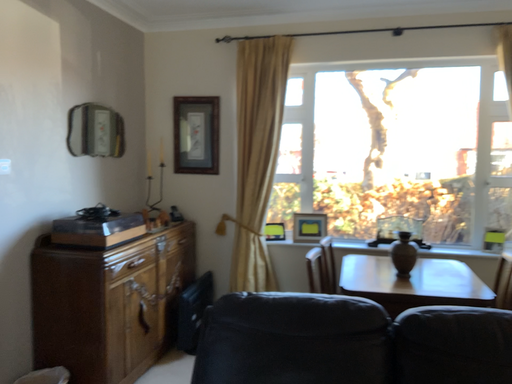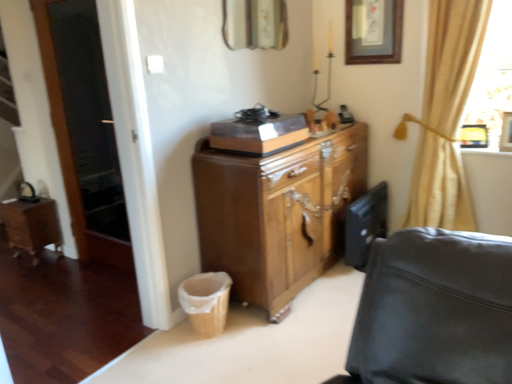
Question: How did the camera likely rotate when shooting the video?

Choices:
 (A) rotated upward
 (B) rotated downward

Answer: (B)